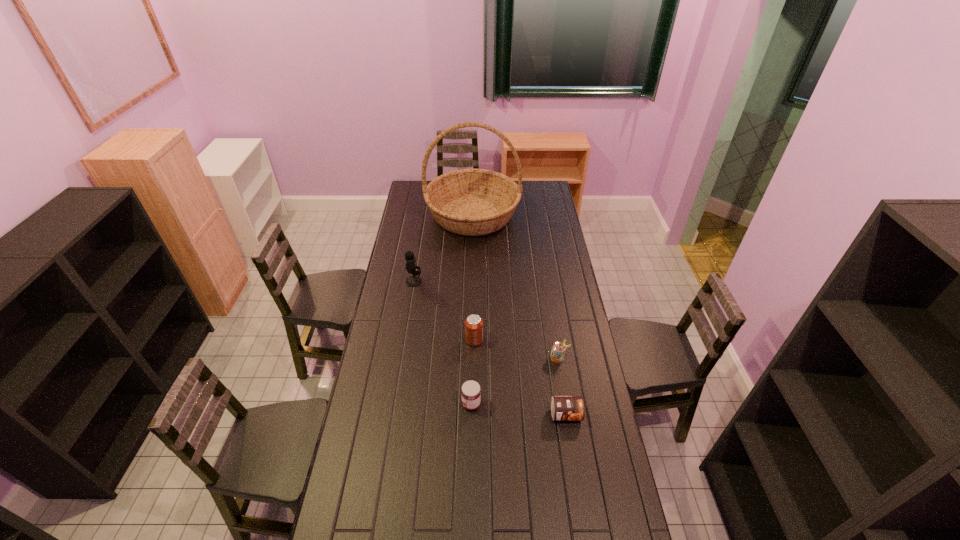
I want to click on the farthest object, so 471,202.

This screenshot has width=960, height=540. What are the coordinates of `basket` in the screenshot? It's located at (471, 202).

At what (x,y) coordinates should I click in order to perform the action: click on the fifth shortest object. Please return your answer as a coordinate pair (x, y). Looking at the image, I should click on (412, 281).

Image resolution: width=960 pixels, height=540 pixels. In order to click on the fifth nearest object in this screenshot , I will do `click(412, 281)`.

Locate an element on the screen. The width and height of the screenshot is (960, 540). the third tallest object is located at coordinates (473, 324).

Where is `the farthest can`? This screenshot has width=960, height=540. the farthest can is located at coordinates (473, 324).

This screenshot has width=960, height=540. In order to click on the second farthest can in this screenshot , I will do `click(558, 348)`.

The width and height of the screenshot is (960, 540). What are the coordinates of `the second shortest can` in the screenshot? It's located at pos(558,348).

Locate an element on the screen. This screenshot has height=540, width=960. jam is located at coordinates (470, 393).

Where is `the shortest object`? This screenshot has width=960, height=540. the shortest object is located at coordinates (563, 408).